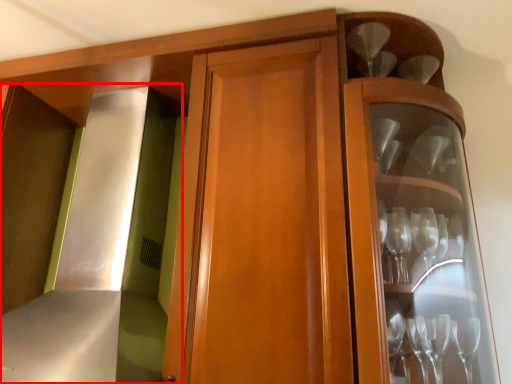
Question: In this image, where is exhaust hood (annotated by the red box) located relative to wine glass?

Choices:
 (A) left
 (B) right

Answer: (A)